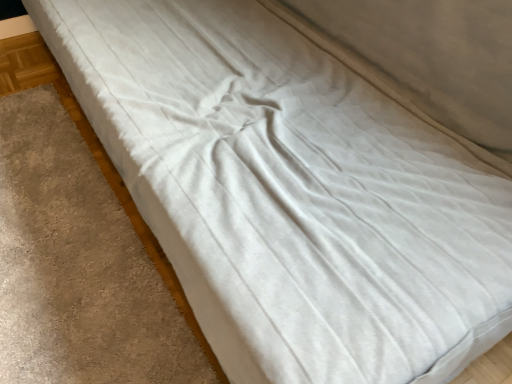
The width and height of the screenshot is (512, 384). What are the coordinates of `vacant area on top of white fabric at lower left (from a real-world perspective)` in the screenshot? It's located at (57, 229).